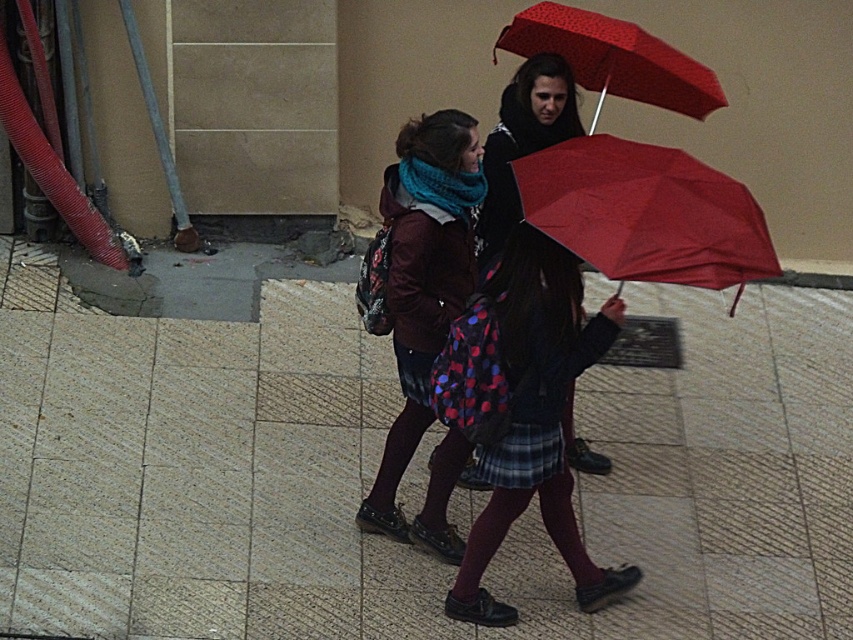
You are a photographer trying to capture both the polka dot fabric dress at center and the matte black jacket at center in a single frame. Based on their positions, which object should you adjust your camera angle to focus on first to ensure both are in the frame?

The polka dot fabric dress at center might be wider than matte black jacket at center, so you should focus on the polka dot fabric dress at center first to ensure both fit within the frame.

You are standing in the scene and want to place a small flowerpot between the two points, point (595, 570) and point (582, 445). Which point should the flowerpot be closer to in order to be equidistant from both points?

The flowerpot should be placed exactly halfway between point (595, 570) and point (582, 445) to be equidistant from both points.

You are a fashion designer observing two outfits in an urban setting. You see the polka dot fabric dress at center and the red dotted umbrella at upper center. Which item is taller?

The polka dot fabric dress at center is taller than the red dotted umbrella at upper center.